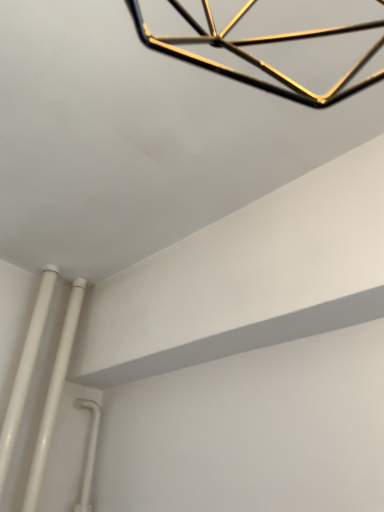
Find the location of a particular element. The height and width of the screenshot is (512, 384). white glossy pipe at lower left, which is counted as the second pipe, starting from the right is located at coordinates (25, 370).

This screenshot has width=384, height=512. What do you see at coordinates (25, 370) in the screenshot?
I see `white glossy pipe at lower left, which is counted as the second pipe, starting from the right` at bounding box center [25, 370].

Measure the distance between point (25, 383) and camera.

The depth of point (25, 383) is 4.11 feet.

How much space does white glossy pipes at lower left, which is counted as the second pipe, starting from the left, occupy horizontally?

white glossy pipes at lower left, which is counted as the second pipe, starting from the left, is 1.58 inches wide.

Locate an element on the screen. white glossy pipes at lower left, arranged as the 1th pipe when viewed from the right is located at coordinates (54, 396).

What do you see at coordinates (54, 396) in the screenshot?
I see `white glossy pipes at lower left, arranged as the 1th pipe when viewed from the right` at bounding box center [54, 396].

The image size is (384, 512). I want to click on white glossy pipe at lower left, which is counted as the second pipe, starting from the right, so click(x=25, y=370).

Visually, is white glossy pipes at lower left, arranged as the 1th pipe when viewed from the right, positioned to the left or to the right of white glossy pipe at lower left, positioned as the first pipe in left-to-right order?

In the image, white glossy pipes at lower left, arranged as the 1th pipe when viewed from the right, appears on the right side of white glossy pipe at lower left, positioned as the first pipe in left-to-right order.

Relative to white glossy pipe at lower left, positioned as the first pipe in left-to-right order, is white glossy pipes at lower left, arranged as the 1th pipe when viewed from the right, in front or behind?

Clearly, white glossy pipes at lower left, arranged as the 1th pipe when viewed from the right, is behind white glossy pipe at lower left, positioned as the first pipe in left-to-right order.

Which is farther, (57, 397) or (2, 460)?

The point (57, 397) is behind.

From the image's perspective, is white glossy pipes at lower left, arranged as the 1th pipe when viewed from the right, below white glossy pipe at lower left, positioned as the first pipe in left-to-right order?

Yes, from the image's perspective, white glossy pipes at lower left, arranged as the 1th pipe when viewed from the right, is below white glossy pipe at lower left, positioned as the first pipe in left-to-right order.

From a real-world perspective, who is located lower, white glossy pipes at lower left, arranged as the 1th pipe when viewed from the right, or white glossy pipe at lower left, positioned as the first pipe in left-to-right order?

In real-world perspective, white glossy pipe at lower left, positioned as the first pipe in left-to-right order, is lower.

Can you confirm if white glossy pipes at lower left, which is counted as the second pipe, starting from the left, is wider than white glossy pipe at lower left, positioned as the first pipe in left-to-right order?

Correct, the width of white glossy pipes at lower left, which is counted as the second pipe, starting from the left, exceeds that of white glossy pipe at lower left, positioned as the first pipe in left-to-right order.

Is white glossy pipes at lower left, arranged as the 1th pipe when viewed from the right, shorter than white glossy pipe at lower left, positioned as the first pipe in left-to-right order?

Yes.

Between white glossy pipes at lower left, which is counted as the second pipe, starting from the left, and white glossy pipe at lower left, positioned as the first pipe in left-to-right order, which one has smaller size?

white glossy pipe at lower left, positioned as the first pipe in left-to-right order, is smaller.

Is white glossy pipe at lower left, which is counted as the second pipe, starting from the right, surrounded by white glossy pipes at lower left, arranged as the 1th pipe when viewed from the right?

Definitely not — white glossy pipe at lower left, which is counted as the second pipe, starting from the right, is not inside white glossy pipes at lower left, arranged as the 1th pipe when viewed from the right.

From the picture: Is white glossy pipes at lower left, which is counted as the second pipe, starting from the left, placed right next to white glossy pipe at lower left, which is counted as the second pipe, starting from the right?

Yes, white glossy pipes at lower left, which is counted as the second pipe, starting from the left, is touching white glossy pipe at lower left, which is counted as the second pipe, starting from the right.

Is white glossy pipe at lower left, which is counted as the second pipe, starting from the right, at the back of white glossy pipes at lower left, arranged as the 1th pipe when viewed from the right?

No, white glossy pipe at lower left, which is counted as the second pipe, starting from the right, is not at the back of white glossy pipes at lower left, arranged as the 1th pipe when viewed from the right.

Locate an element on the screen. pipe above the white glossy pipes at lower left, which is counted as the second pipe, starting from the left (from the image's perspective) is located at coordinates [x=25, y=370].

Considering the relative positions of white glossy pipe at lower left, positioned as the first pipe in left-to-right order, and white glossy pipes at lower left, which is counted as the second pipe, starting from the left, in the image provided, is white glossy pipe at lower left, positioned as the first pipe in left-to-right order, to the right of white glossy pipes at lower left, which is counted as the second pipe, starting from the left, from the viewer's perspective?

In fact, white glossy pipe at lower left, positioned as the first pipe in left-to-right order, is to the left of white glossy pipes at lower left, which is counted as the second pipe, starting from the left.

Does white glossy pipe at lower left, which is counted as the second pipe, starting from the right, come in front of white glossy pipes at lower left, which is counted as the second pipe, starting from the left?

Yes, white glossy pipe at lower left, which is counted as the second pipe, starting from the right, is closer to the camera.

Is point (38, 329) closer or farther from the camera than point (41, 478)?

Point (38, 329).

From the image's perspective, is white glossy pipe at lower left, positioned as the first pipe in left-to-right order, above or below white glossy pipes at lower left, which is counted as the second pipe, starting from the left?

Based on their image positions, white glossy pipe at lower left, positioned as the first pipe in left-to-right order, is located above white glossy pipes at lower left, which is counted as the second pipe, starting from the left.

From a real-world perspective, is white glossy pipe at lower left, positioned as the first pipe in left-to-right order, positioned over white glossy pipes at lower left, which is counted as the second pipe, starting from the left, based on gravity?

No, from a real-world perspective, white glossy pipe at lower left, positioned as the first pipe in left-to-right order, is not over white glossy pipes at lower left, which is counted as the second pipe, starting from the left

Can you confirm if white glossy pipe at lower left, which is counted as the second pipe, starting from the right, is wider than white glossy pipes at lower left, which is counted as the second pipe, starting from the left?

No.

Does white glossy pipe at lower left, which is counted as the second pipe, starting from the right, have a lesser height compared to white glossy pipes at lower left, arranged as the 1th pipe when viewed from the right?

No.

Considering the relative sizes of white glossy pipe at lower left, which is counted as the second pipe, starting from the right, and white glossy pipes at lower left, which is counted as the second pipe, starting from the left, in the image provided, is white glossy pipe at lower left, which is counted as the second pipe, starting from the right, bigger than white glossy pipes at lower left, which is counted as the second pipe, starting from the left,?

Actually, white glossy pipe at lower left, which is counted as the second pipe, starting from the right, might be smaller than white glossy pipes at lower left, which is counted as the second pipe, starting from the left.

Is white glossy pipe at lower left, which is counted as the second pipe, starting from the right, inside or outside of white glossy pipes at lower left, which is counted as the second pipe, starting from the left?

white glossy pipe at lower left, which is counted as the second pipe, starting from the right, is spatially situated outside white glossy pipes at lower left, which is counted as the second pipe, starting from the left.

Does white glossy pipe at lower left, which is counted as the second pipe, starting from the right, touch white glossy pipes at lower left, arranged as the 1th pipe when viewed from the right?

Yes, white glossy pipe at lower left, which is counted as the second pipe, starting from the right, is right next to white glossy pipes at lower left, arranged as the 1th pipe when viewed from the right, and making contact.

Could you tell me if white glossy pipe at lower left, positioned as the first pipe in left-to-right order, is turned towards white glossy pipes at lower left, which is counted as the second pipe, starting from the left?

No, white glossy pipe at lower left, positioned as the first pipe in left-to-right order, is not aimed at white glossy pipes at lower left, which is counted as the second pipe, starting from the left.

Measure the distance between white glossy pipe at lower left, positioned as the first pipe in left-to-right order, and white glossy pipes at lower left, arranged as the 1th pipe when viewed from the right.

white glossy pipe at lower left, positioned as the first pipe in left-to-right order, and white glossy pipes at lower left, arranged as the 1th pipe when viewed from the right, are 3.93 inches apart.

You are a GUI agent. You are given a task and a screenshot of the screen. Output one action in this format:
    pyautogui.click(x=<x>, y=<y>)
    Task: Click on the pipe located above the white glossy pipes at lower left, which is counted as the second pipe, starting from the left (from the image's perspective)
    This screenshot has height=512, width=384.
    Given the screenshot: What is the action you would take?
    pyautogui.click(x=25, y=370)

At what (x,y) coordinates should I click in order to perform the action: click on pipe located on the right of white glossy pipe at lower left, positioned as the first pipe in left-to-right order. Please return your answer as a coordinate pair (x, y). Looking at the image, I should click on (54, 396).

Where is `pipe below the white glossy pipes at lower left, which is counted as the second pipe, starting from the left (from a real-world perspective)`? This screenshot has width=384, height=512. pipe below the white glossy pipes at lower left, which is counted as the second pipe, starting from the left (from a real-world perspective) is located at coordinates (25, 370).